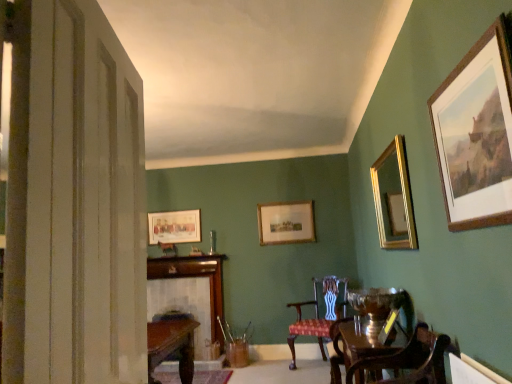
Question: Can you confirm if shiny brown wood round table at lower right is shorter than wooden picture frame at upper right, which is the 4th picture frame in back-to-front order?

Choices:
 (A) yes
 (B) no

Answer: (A)

Question: Is shiny brown wood round table at lower right facing away from wooden picture frame at upper right, which ranks as the 2th picture frame in right-to-left order?

Choices:
 (A) no
 (B) yes

Answer: (A)

Question: Is shiny brown wood round table at lower right not near wooden picture frame at upper right, which ranks as the 2th picture frame in right-to-left order?

Choices:
 (A) yes
 (B) no

Answer: (A)

Question: Does shiny brown wood round table at lower right have a larger size compared to wooden picture frame at upper right, which is the 4th picture frame in back-to-front order?

Choices:
 (A) no
 (B) yes

Answer: (B)

Question: From a real-world perspective, is shiny brown wood round table at lower right physically below wooden picture frame at upper right, positioned as the 1th picture frame in front-to-back order?

Choices:
 (A) no
 (B) yes

Answer: (B)

Question: Is shiny brown wood round table at lower right positioned beyond the bounds of wooden picture frame at upper right, positioned as the 1th picture frame in front-to-back order?

Choices:
 (A) yes
 (B) no

Answer: (A)

Question: Is red upholstered chair at center, marked as the first chair in a bottom-to-top arrangement, positioned beyond the bounds of wooden fireplace at center?

Choices:
 (A) no
 (B) yes

Answer: (B)

Question: Is red upholstered chair at center, marked as the first chair in a back-to-front arrangement, bigger than wooden fireplace at center?

Choices:
 (A) no
 (B) yes

Answer: (B)

Question: Is red upholstered chair at center, marked as the first chair in a bottom-to-top arrangement, smaller than wooden fireplace at center?

Choices:
 (A) yes
 (B) no

Answer: (B)

Question: Is red upholstered chair at center, which ranks as the 2th chair in top-to-bottom order, behind wooden fireplace at center?

Choices:
 (A) yes
 (B) no

Answer: (B)

Question: Does red upholstered chair at center, positioned as the 2th chair in front-to-back order, have a lesser width compared to wooden fireplace at center?

Choices:
 (A) no
 (B) yes

Answer: (A)

Question: From the image's perspective, does red upholstered chair at center, marked as the first chair in a back-to-front arrangement, appear lower than wooden fireplace at center?

Choices:
 (A) yes
 (B) no

Answer: (B)

Question: Are matte gold picture frame at upper left, arranged as the 4th picture frame when viewed from the front, and wooden framed picture at center, which ranks as the 2th picture frame in left-to-right order, far apart?

Choices:
 (A) yes
 (B) no

Answer: (A)